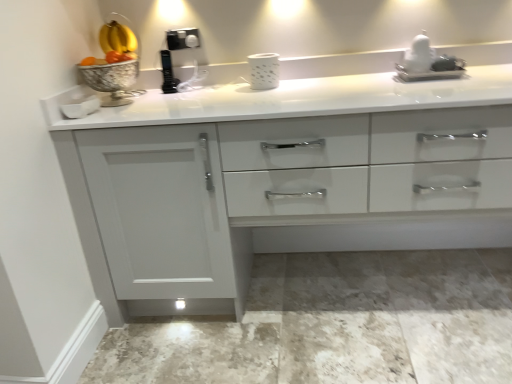
Question: From the image's perspective, does white glossy countertop at center appear lower than white glossy statue at upper right?

Choices:
 (A) yes
 (B) no

Answer: (A)

Question: Does white glossy countertop at center lie behind white glossy statue at upper right?

Choices:
 (A) no
 (B) yes

Answer: (A)

Question: From a real-world perspective, is white glossy countertop at center located beneath white glossy statue at upper right?

Choices:
 (A) no
 (B) yes

Answer: (B)

Question: Does white glossy countertop at center have a lesser width compared to white glossy statue at upper right?

Choices:
 (A) no
 (B) yes

Answer: (A)

Question: Is white glossy countertop at center surrounding white glossy statue at upper right?

Choices:
 (A) yes
 (B) no

Answer: (A)

Question: From the image's perspective, would you say white glossy countertop at center is positioned over white glossy statue at upper right?

Choices:
 (A) no
 (B) yes

Answer: (A)

Question: Can you confirm if white glossy statue at upper right is positioned to the right of white glossy countertop at center?

Choices:
 (A) no
 (B) yes

Answer: (B)

Question: From a real-world perspective, is white glossy statue at upper right on top of white glossy countertop at center?

Choices:
 (A) no
 (B) yes

Answer: (B)

Question: From a real-world perspective, is white glossy statue at upper right below white glossy countertop at center?

Choices:
 (A) no
 (B) yes

Answer: (A)

Question: Does white glossy statue at upper right lie in front of white glossy countertop at center?

Choices:
 (A) no
 (B) yes

Answer: (A)

Question: From the image's perspective, would you say white glossy statue at upper right is shown under white glossy countertop at center?

Choices:
 (A) yes
 (B) no

Answer: (B)

Question: Considering the relative sizes of white glossy statue at upper right and white glossy countertop at center in the image provided, is white glossy statue at upper right wider than white glossy countertop at center?

Choices:
 (A) yes
 (B) no

Answer: (B)

Question: Is white glossy statue at upper right wider or thinner than white glossy countertop at center?

Choices:
 (A) thin
 (B) wide

Answer: (A)